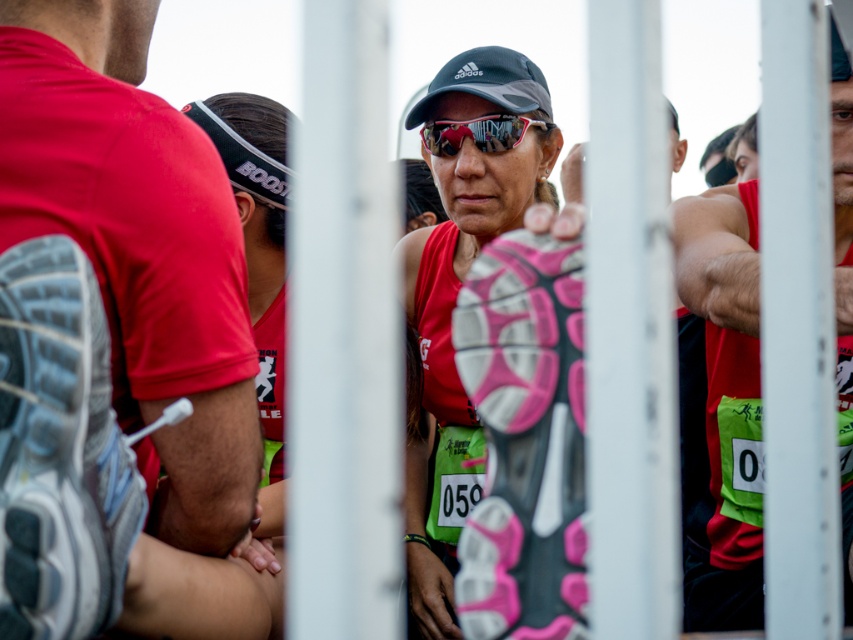
You are a photographer at the race and want to capture the runner in the red tank top at center. Which one is taller between the matte red tank top at center and the shiny red tank top at center?

The matte red tank top at center is much taller than the shiny red tank top at center.

You are a photographer at the race and want to capture a clear shot of both the matte red shirt at left and the shiny red tank top at center. Can you see both of them fully in your photo?

The matte red shirt at left is in front of the shiny red tank top at center, so the photographer might not be able to see the shiny red tank top at center fully as it is partially blocked by the matte red shirt at left.

You are a photographer at the race and want to take a photo of the shiny red tank top at center and the matte black goggles at center. Which object is closer to the camera?

The shiny red tank top at center is closer to the camera than the matte black goggles at center because it is in front of it.